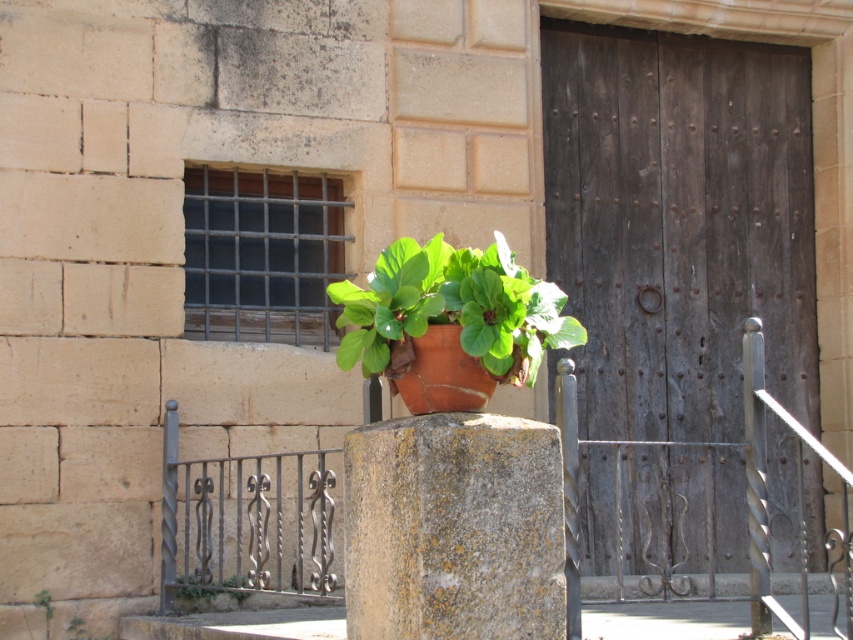
You are standing in front of the building and want to reach the green leafy plant at lower center. Which direction should you move relative to the dark brown wooden door at center?

The dark brown wooden door at center is above the green leafy plant at lower center, so you should move downward or towards the lower part of the building to reach the green leafy plant at lower center.